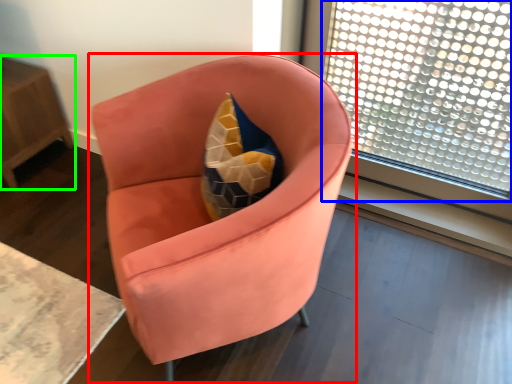
Question: Which object is positioned farthest from chair (highlighted by a red box)? Select from window (highlighted by a blue box) and table (highlighted by a green box).

Choices:
 (A) window
 (B) table

Answer: (B)